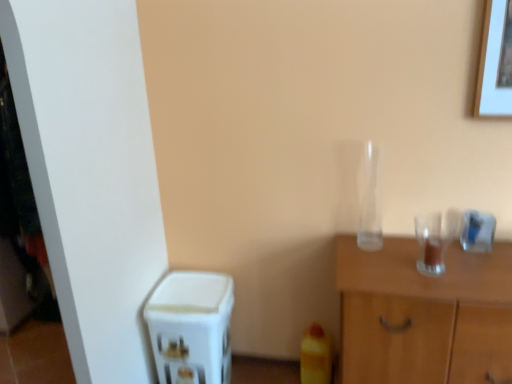
What is the approximate height of transparent glass cabinet at right?

It is 30.99 inches.

The width and height of the screenshot is (512, 384). Describe the element at coordinates (424, 314) in the screenshot. I see `transparent glass cabinet at right` at that location.

This screenshot has height=384, width=512. What do you see at coordinates (370, 203) in the screenshot? I see `transparent glass vase at center-right` at bounding box center [370, 203].

What are the coordinates of `transparent glass cabinet at right` in the screenshot? It's located at (424, 314).

From a real-world perspective, which is physically above, white plastic water dispenser at lower left or transparent glass vase at center-right?

transparent glass vase at center-right, from a real-world perspective.

From the image's perspective, is white plastic water dispenser at lower left located beneath transparent glass vase at center-right?

Indeed, from the image's perspective, white plastic water dispenser at lower left is shown beneath transparent glass vase at center-right.

Is white plastic water dispenser at lower left facing towards transparent glass vase at center-right?

No, white plastic water dispenser at lower left is not oriented towards transparent glass vase at center-right.

Considering the positions of point (376, 183) and point (480, 369), is point (376, 183) closer or farther from the camera than point (480, 369)?

Point (376, 183) is farther from the camera than point (480, 369).

From the image's perspective, does transparent glass vase at center-right appear lower than transparent glass cabinet at right?

Actually, transparent glass vase at center-right appears above transparent glass cabinet at right in the image.

Is transparent glass vase at center-right taller or shorter than transparent glass cabinet at right?

transparent glass vase at center-right is shorter than transparent glass cabinet at right.

Measure the distance from transparent glass cabinet at right to transparent glass vase at center-right.

transparent glass cabinet at right and transparent glass vase at center-right are 12.84 inches apart.

Can you confirm if transparent glass cabinet at right is thinner than transparent glass vase at center-right?

Incorrect, the width of transparent glass cabinet at right is not less than that of transparent glass vase at center-right.

From the image's perspective, which one is positioned higher, transparent glass cabinet at right or transparent glass vase at center-right?

transparent glass vase at center-right, from the image's perspective.

In the scene shown: From a real-world perspective, is transparent glass cabinet at right under transparent glass vase at center-right?

Yes, from a real-world perspective, transparent glass cabinet at right is beneath transparent glass vase at center-right.

Who is smaller, transparent glass vase at center-right or white plastic water dispenser at lower left?

Smaller between the two is transparent glass vase at center-right.

Does transparent glass vase at center-right have a greater height compared to white plastic water dispenser at lower left?

No.

Considering the positions of objects transparent glass vase at center-right and white plastic water dispenser at lower left in the image provided, who is more to the left, transparent glass vase at center-right or white plastic water dispenser at lower left?

white plastic water dispenser at lower left.

In the scene shown: How much distance is there between transparent glass vase at center-right and white plastic water dispenser at lower left?

transparent glass vase at center-right is 32.54 inches away from white plastic water dispenser at lower left.

Would you consider white plastic water dispenser at lower left to be distant from transparent glass cabinet at right?

white plastic water dispenser at lower left is near transparent glass cabinet at right, not far away.

From the image's perspective, is white plastic water dispenser at lower left above or below transparent glass cabinet at right?

From the image's perspective, white plastic water dispenser at lower left appears below transparent glass cabinet at right.

Can transparent glass cabinet at right be found inside white plastic water dispenser at lower left?

Definitely not — transparent glass cabinet at right is not inside white plastic water dispenser at lower left.

How many degrees apart are the facing directions of white plastic water dispenser at lower left and transparent glass cabinet at right?

The facing directions of white plastic water dispenser at lower left and transparent glass cabinet at right are 0.553 degrees apart.

Is transparent glass cabinet at right turned away from white plastic water dispenser at lower left?

No, transparent glass cabinet at right is not facing away from white plastic water dispenser at lower left.

Where is `appliance that is under the transparent glass cabinet at right (from a real-world perspective)`? Image resolution: width=512 pixels, height=384 pixels. appliance that is under the transparent glass cabinet at right (from a real-world perspective) is located at coordinates (191, 327).

Measure the distance from transparent glass cabinet at right to white plastic water dispenser at lower left.

30.62 inches.

Based on their sizes in the image, would you say transparent glass cabinet at right is bigger or smaller than white plastic water dispenser at lower left?

Considering their sizes, transparent glass cabinet at right takes up more space than white plastic water dispenser at lower left.

The width and height of the screenshot is (512, 384). What are the coordinates of `glass vase in front of the white plastic water dispenser at lower left` in the screenshot? It's located at (370, 203).

I want to click on glass vase lying above the transparent glass cabinet at right (from the image's perspective), so click(x=370, y=203).

Which object lies further to the anchor point white plastic water dispenser at lower left, transparent glass cabinet at right or transparent glass vase at center-right?

Among the two, transparent glass vase at center-right is located further to white plastic water dispenser at lower left.

Estimate the real-world distances between objects in this image. Which object is closer to transparent glass vase at center-right, white plastic water dispenser at lower left or transparent glass cabinet at right?

Among the two, transparent glass cabinet at right is located nearer to transparent glass vase at center-right.

Looking at this image, when comparing their distances from transparent glass cabinet at right, does transparent glass vase at center-right or white plastic water dispenser at lower left seem further?

Among the two, white plastic water dispenser at lower left is located further to transparent glass cabinet at right.

Looking at the image, which one is located further to transparent glass cabinet at right, white plastic water dispenser at lower left or transparent glass vase at center-right?

white plastic water dispenser at lower left lies further to transparent glass cabinet at right than the other object.

Based on their spatial positions, is transparent glass cabinet at right or white plastic water dispenser at lower left closer to transparent glass vase at center-right?

transparent glass cabinet at right lies closer to transparent glass vase at center-right than the other object.

Based on their spatial positions, is transparent glass vase at center-right or transparent glass cabinet at right closer to white plastic water dispenser at lower left?

Based on the image, transparent glass cabinet at right appears to be nearer to white plastic water dispenser at lower left.

I want to click on glass vase between white plastic water dispenser at lower left and transparent glass cabinet at right from left to right, so click(x=370, y=203).